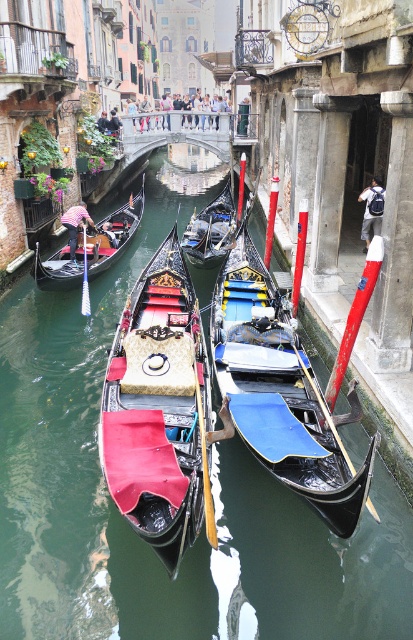
You are a tourist standing on the canal edge and want to take a photo of both the velvet red gondola at center and the black polished wood gondola at center. Which gondola should you position your camera higher to capture its full height in the photo?

The velvet red gondola at center has a greater height compared to the black polished wood gondola at center, so you should position your camera higher to capture its full height.

You are a tourist standing on the canal edge and want to take a photo of both the velvet red gondola at center and the black polished wood gondola at center. Which gondola should you stand closer to in order to capture both in the same frame?

You should stand closer to the velvet red gondola at center because it is positioned under the black polished wood gondola at center, so capturing both in the same frame would require positioning yourself closer to the lower one to include both in the photo.